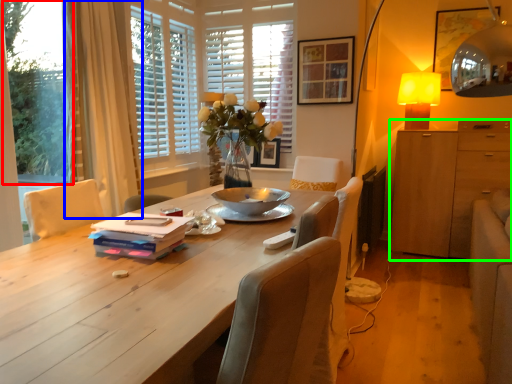
Question: Which is farther away from window screen (highlighted by a red box)? curtain (highlighted by a blue box) or cabinetry (highlighted by a green box)?

Choices:
 (A) curtain
 (B) cabinetry

Answer: (B)